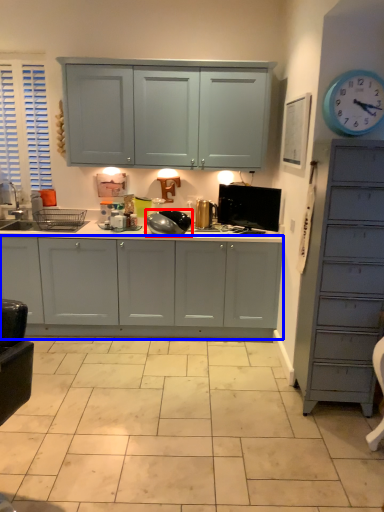
Question: Which point is further to the camera, appliance (highlighted by a red box) or cabinetry (highlighted by a blue box)?

Choices:
 (A) appliance
 (B) cabinetry

Answer: (A)